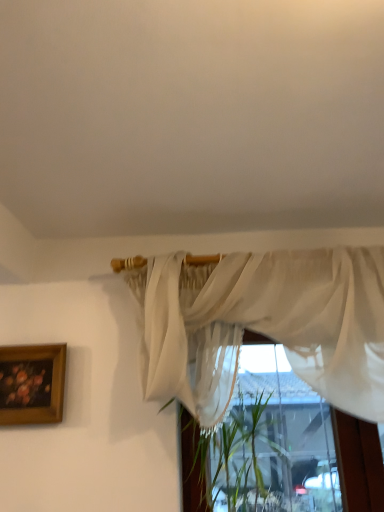
What do you see at coordinates (32, 384) in the screenshot? Image resolution: width=384 pixels, height=512 pixels. I see `wooden framed painting at lower left` at bounding box center [32, 384].

The image size is (384, 512). I want to click on wooden framed painting at lower left, so click(x=32, y=384).

Find the location of a particular element. The height and width of the screenshot is (512, 384). wooden framed painting at lower left is located at coordinates (32, 384).